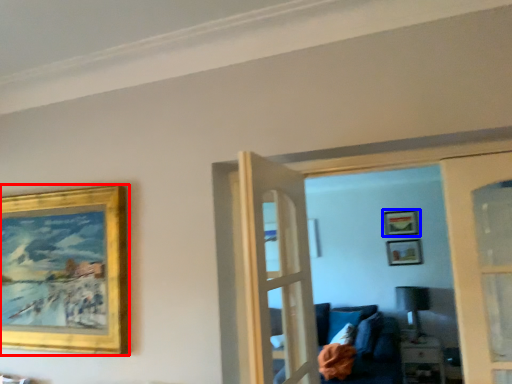
Question: Which point is closer to the camera, picture frame (highlighted by a red box) or picture frame (highlighted by a blue box)?

Choices:
 (A) picture frame
 (B) picture frame

Answer: (A)